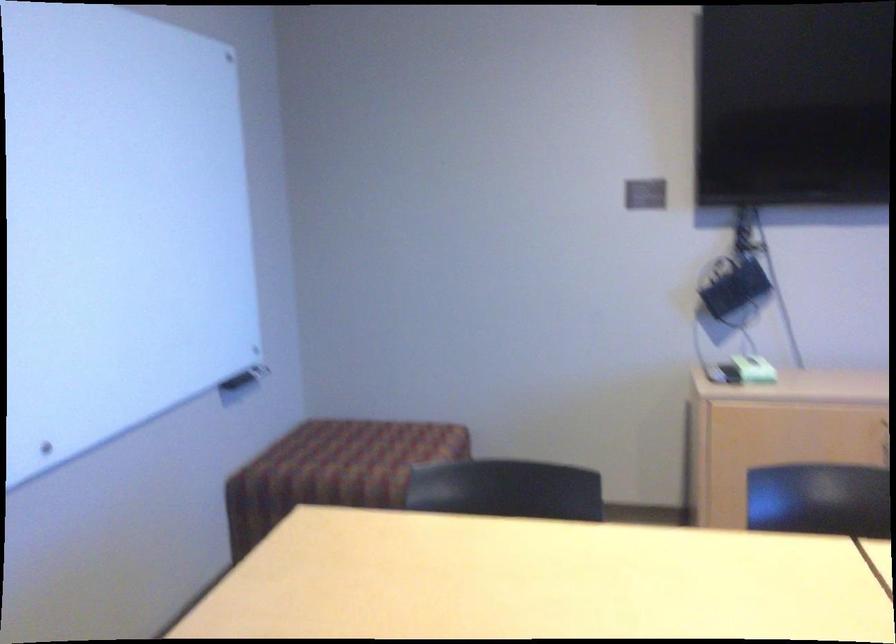
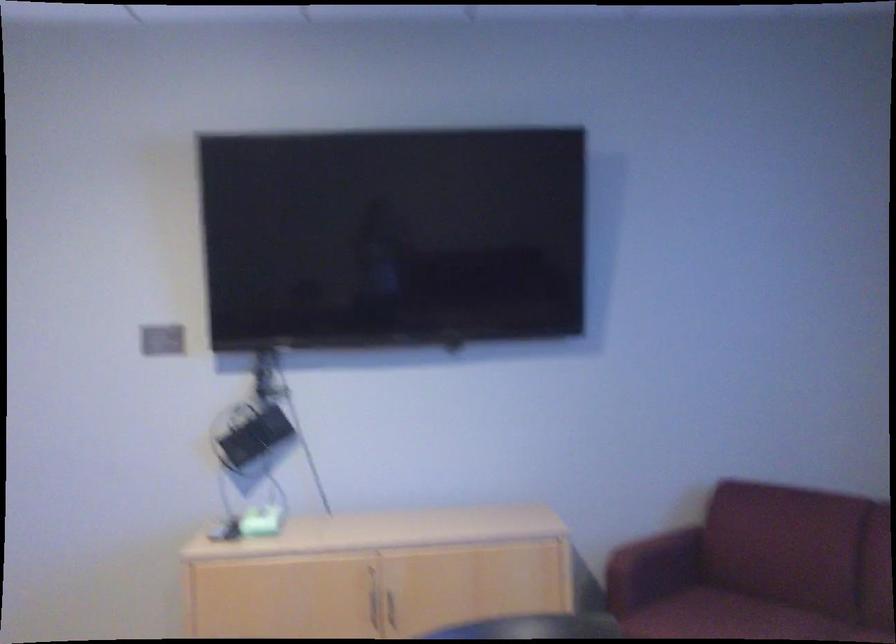
In the second image, find the point that corresponds to (x=752, y=366) in the first image.

(257, 522)